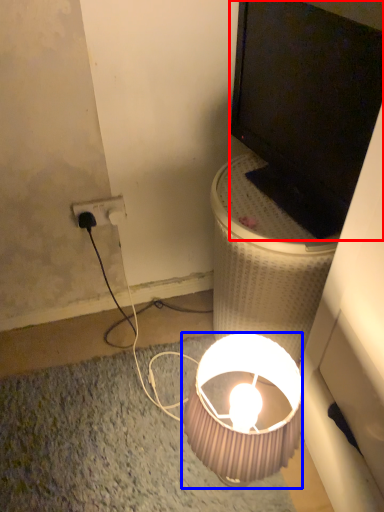
Question: Among these objects, which one is nearest to the camera, television (highlighted by a red box) or lamp (highlighted by a blue box)?

Choices:
 (A) television
 (B) lamp

Answer: (A)